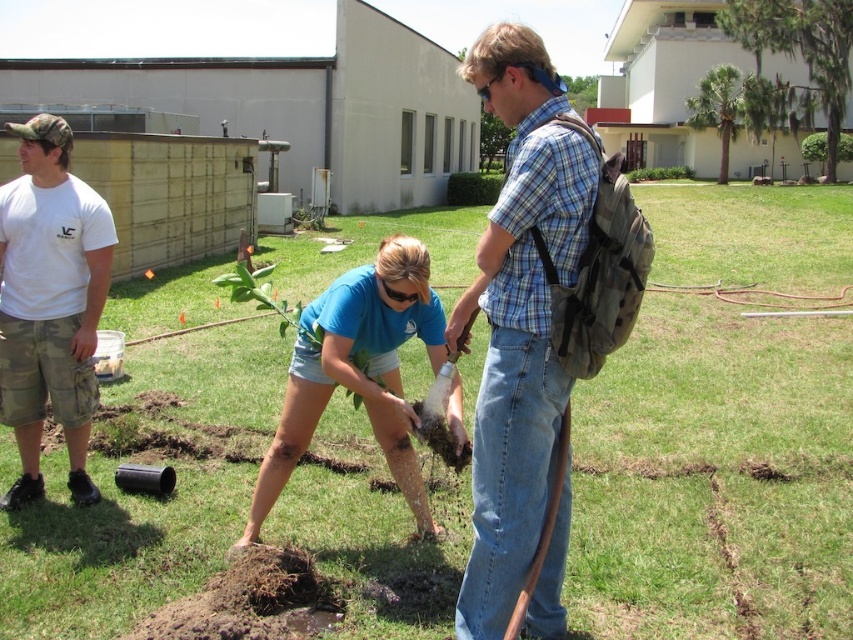
You are a landscape designer observing the outdoor scene. You need to determine which object is wider between the green leafy tree at upper right and the green leafy plant at center. Which one is wider?

The green leafy tree at upper right is wider than the green leafy plant at center.

You are standing at the point with coordinates point (6, 241) and want to move to the point with coordinates point (485, 259). Is the point you want to go to in front of or behind you?

The point (485, 259) is in front of point (6, 241), so the destination is in front of you.